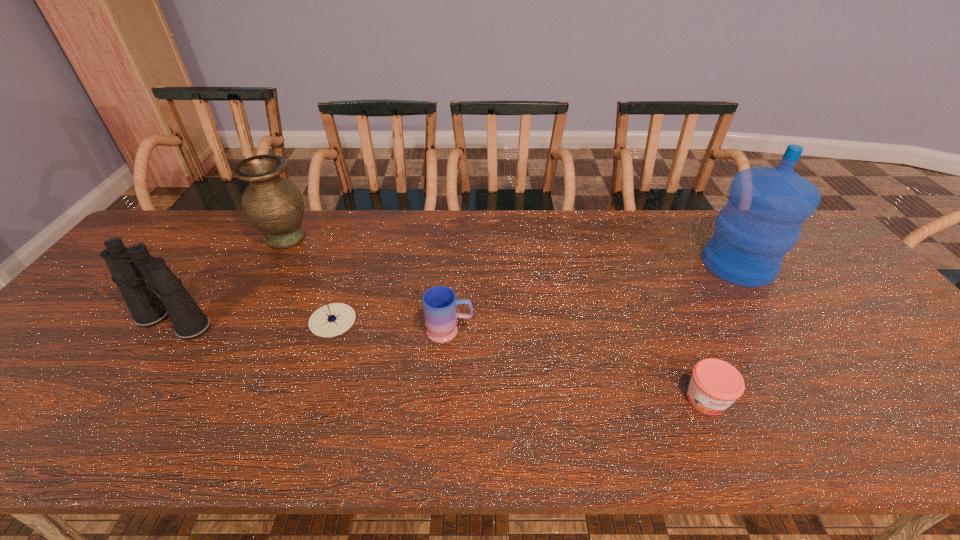
This screenshot has width=960, height=540. What are the coordinates of `the tallest object` in the screenshot? It's located at (767, 206).

Where is `water jug`? This screenshot has height=540, width=960. water jug is located at coordinates click(x=767, y=206).

This screenshot has height=540, width=960. I want to click on vase, so click(274, 205).

The width and height of the screenshot is (960, 540). Find the location of `binoculars`. binoculars is located at coordinates (130, 267).

In order to click on the third shortest object in this screenshot , I will do `click(440, 304)`.

You are a GUI agent. You are given a task and a screenshot of the screen. Output one action in this format:
    pyautogui.click(x=<x>, y=<y>)
    Task: Click on the mug
    The image size is (960, 540).
    Given the screenshot: What is the action you would take?
    pyautogui.click(x=440, y=304)

Locate an element on the screen. Image resolution: width=960 pixels, height=540 pixels. jam is located at coordinates (715, 384).

Where is `the fifth object from left to right`? The width and height of the screenshot is (960, 540). the fifth object from left to right is located at coordinates (715, 384).

At what (x,y) coordinates should I click in order to perform the action: click on compass. Please return your answer as a coordinate pair (x, y). The image size is (960, 540). Looking at the image, I should click on (331, 320).

The image size is (960, 540). In order to click on the shortest object in this screenshot , I will do `click(331, 320)`.